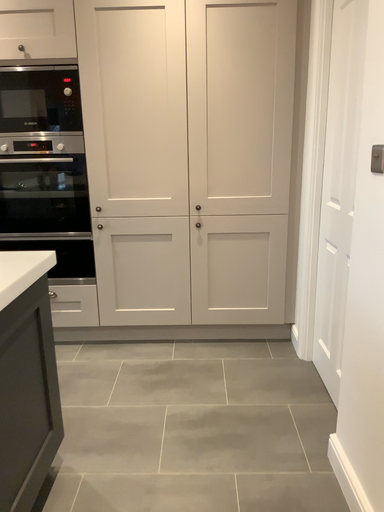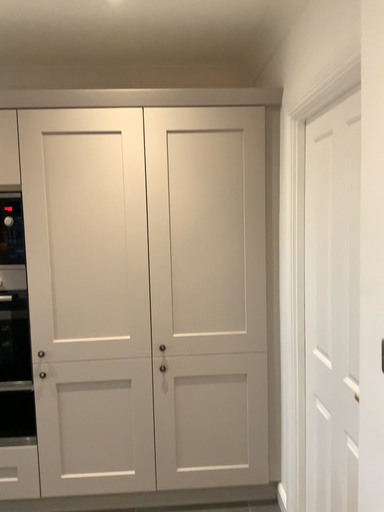
Question: Which way did the camera rotate in the video?

Choices:
 (A) rotated upward
 (B) rotated downward

Answer: (A)